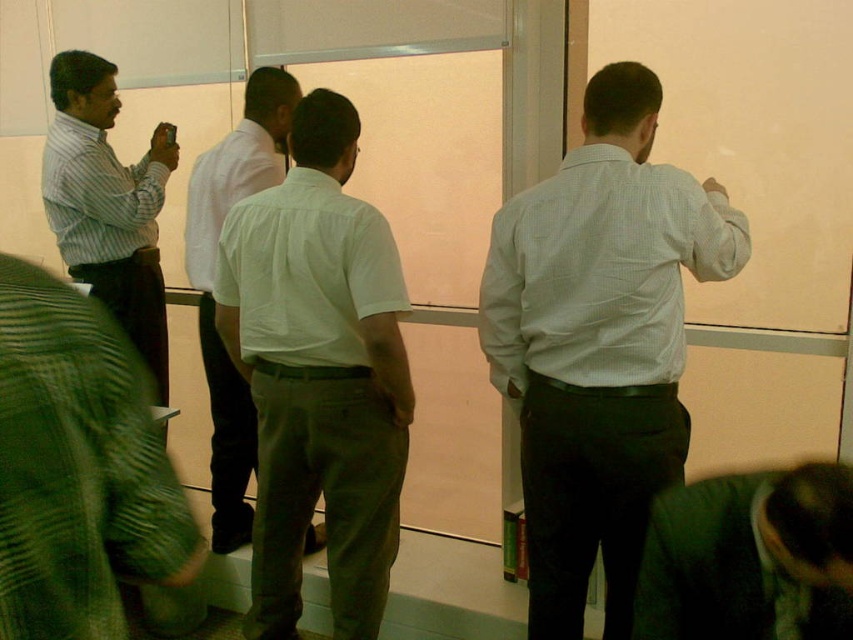
You are organizing a photo shoot and need to position the dark green suit at lower right and the white shirt at left in a way that maintains their relative sizes as shown in the image. Which object should be placed closer to the camera to achieve this effect?

The dark green suit at lower right is smaller than the white shirt at left, so to maintain their relative sizes, the dark green suit at lower right should be placed farther from the camera compared to the white shirt at left.

You are standing in the room and want to hand a document to both the green textured shirt at lower left and the striped cotton shirt at left. Which one should you approach first to ensure you can reach them without moving around the furniture?

You should approach the green textured shirt at lower left first since it is closer to you than the striped cotton shirt at left, so you can reach them more easily without needing to move around any furniture.

You are a photographer trying to capture a clear photo of the striped cotton shirt at left. However, the dark green suit at lower right is blocking your view. Can you adjust your position to take the photo without moving any of the subjects?

The dark green suit at lower right is in front of the striped cotton shirt at left, so you can move your position to the left side to take the photo without moving any subjects.